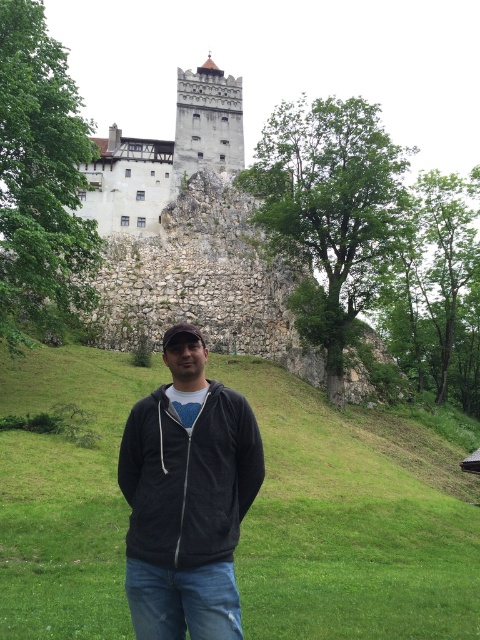
You are a tourist standing on the green grass at center looking towards the white stone tower at upper center. Which direction should you walk to get closer to the tower?

Since the green grass at center is located below the white stone tower at upper center, you should walk upwards towards the tower.

You are standing at the base of the castle and want to determine which of the two points, point (190, 81) or point (180, 68), is closer to you. Based on the image, which point is nearer?

Point (190, 81) is closer to the viewer than point (180, 68).